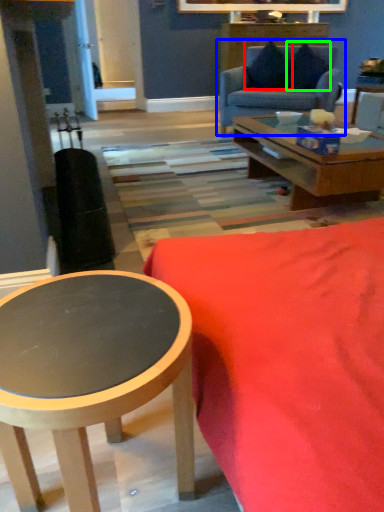
Question: Considering the real-world distances, which object is closest to pillow (highlighted by a red box)? studio couch (highlighted by a blue box) or pillow (highlighted by a green box).

Choices:
 (A) studio couch
 (B) pillow

Answer: (B)